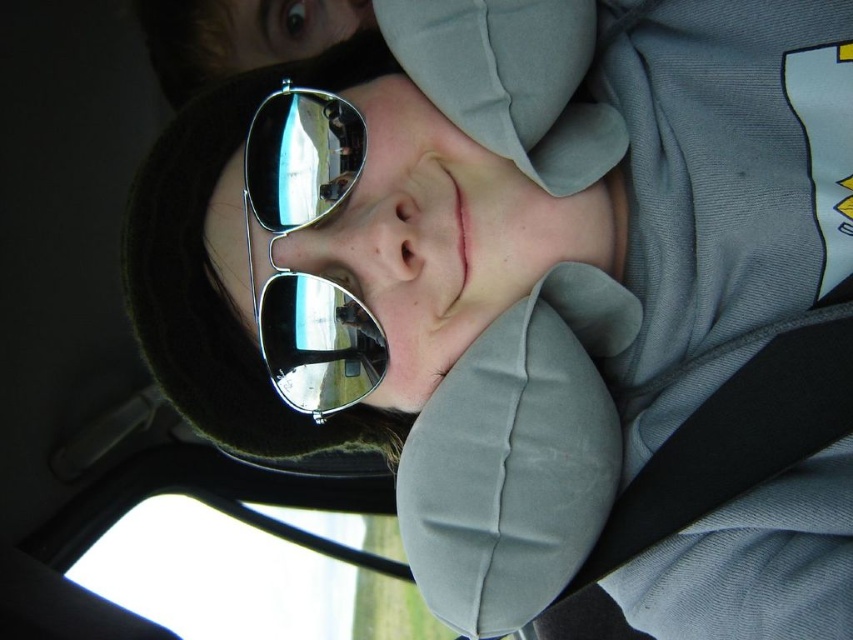
Consider the image. Does transparent glass car window at lower left appear on the left side of metallic reflective sunglasses at center?

Indeed, transparent glass car window at lower left is positioned on the left side of metallic reflective sunglasses at center.

Where is `transparent glass car window at lower left`? transparent glass car window at lower left is located at coordinates (236, 579).

The height and width of the screenshot is (640, 853). I want to click on transparent glass car window at lower left, so [236, 579].